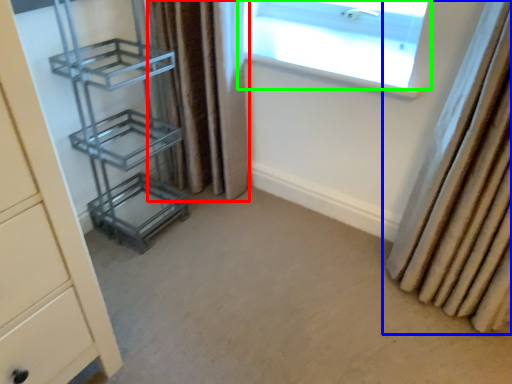
Question: Estimate the real-world distances between objects in this image. Which object is farther from curtain (highlighted by a red box), curtain (highlighted by a blue box) or window (highlighted by a green box)?

Choices:
 (A) curtain
 (B) window

Answer: (A)